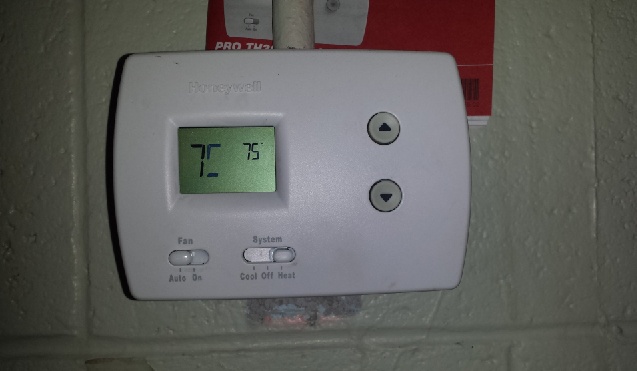
This screenshot has height=371, width=637. I want to click on knob, so click(x=283, y=254).